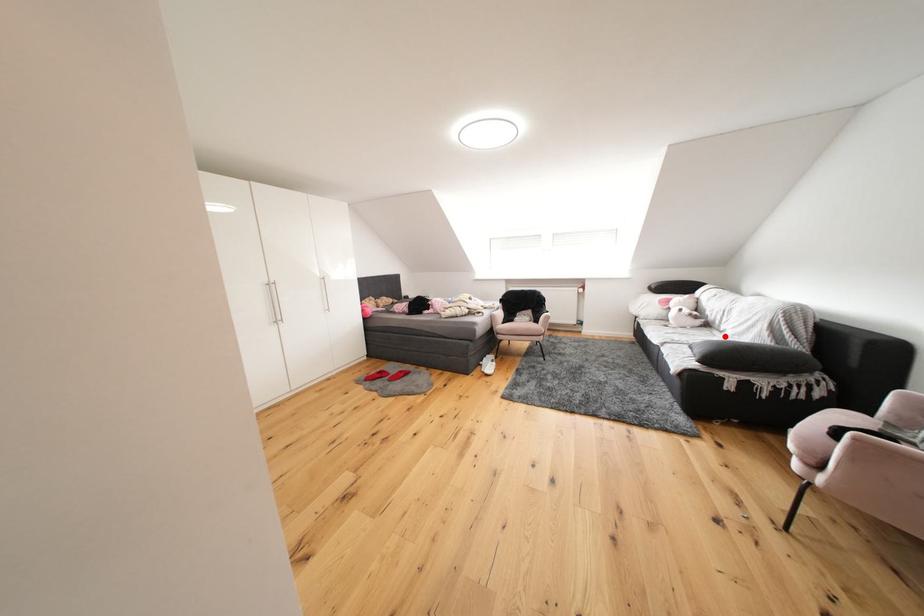
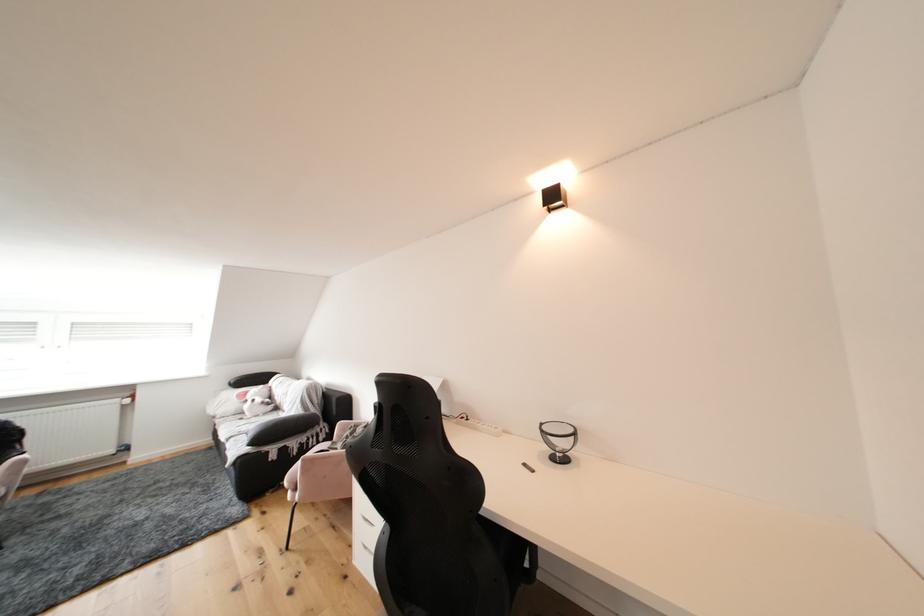
Find the pixel in the second image that matches the highlighted location in the first image.

(290, 416)